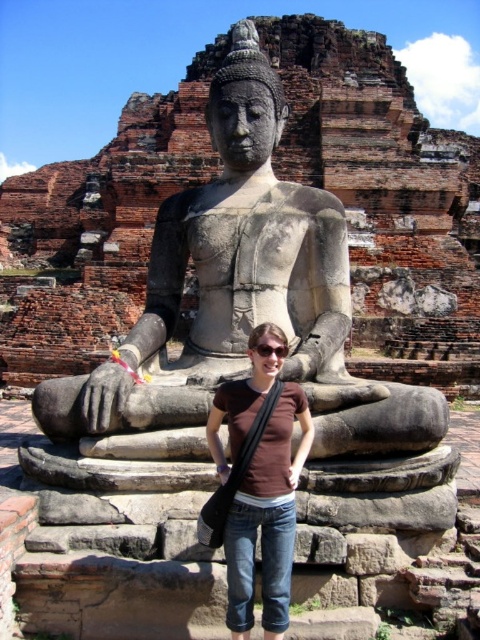
Describe the element at coordinates (245, 294) in the screenshot. I see `gray stone statue at center` at that location.

From the picture: Does gray stone statue at center have a greater height compared to brown cotton shirt at center?

Indeed, gray stone statue at center has a greater height compared to brown cotton shirt at center.

The height and width of the screenshot is (640, 480). Find the location of `gray stone statue at center`. gray stone statue at center is located at coordinates (245, 294).

Locate an element on the screen. The width and height of the screenshot is (480, 640). gray stone statue at center is located at coordinates (245, 294).